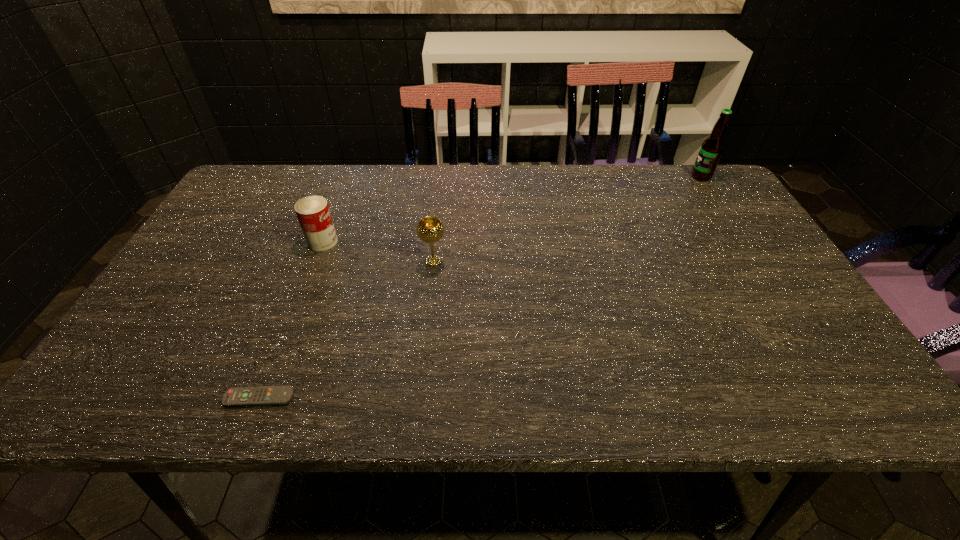
Locate an element on the screen. The height and width of the screenshot is (540, 960). vacant space that's between the remote control and the tallest object is located at coordinates (480, 287).

At what (x,y) coordinates should I click in order to perform the action: click on free spot between the shortest object and the beer bottle. Please return your answer as a coordinate pair (x, y). Looking at the image, I should click on (480, 287).

Identify which object is located as the nearest to the second nearest object. Please provide its 2D coordinates. Your answer should be formatted as a tuple, i.e. [(x, y)], where the tuple contains the x and y coordinates of a point satisfying the conditions above.

[(313, 213)]

This screenshot has width=960, height=540. Identify the location of object that is the second closest one to the third object from left to right. pyautogui.click(x=264, y=395).

At what (x,y) coordinates should I click in order to perform the action: click on vacant area in the image that satisfies the following two spatial constraints: 1. on the front label of the third object from left to right; 2. on the left side of the second farthest object. Please return your answer as a coordinate pair (x, y). The height and width of the screenshot is (540, 960). Looking at the image, I should click on (315, 261).

The height and width of the screenshot is (540, 960). I want to click on vacant area in the image that satisfies the following two spatial constraints: 1. on the front label of the third farthest object; 2. on the left side of the can, so click(x=315, y=261).

The height and width of the screenshot is (540, 960). Identify the location of blank area in the image that satisfies the following two spatial constraints: 1. on the back side of the chalice; 2. on the front label of the can. pos(436,241).

Image resolution: width=960 pixels, height=540 pixels. Find the location of `vacant point that satisfies the following two spatial constraints: 1. on the front label of the third object from left to right; 2. on the left side of the can`. vacant point that satisfies the following two spatial constraints: 1. on the front label of the third object from left to right; 2. on the left side of the can is located at coordinates (315, 261).

This screenshot has width=960, height=540. Find the location of `vacant space that satisfies the following two spatial constraints: 1. on the front label of the third object from left to right; 2. on the right side of the third nearest object`. vacant space that satisfies the following two spatial constraints: 1. on the front label of the third object from left to right; 2. on the right side of the third nearest object is located at coordinates (315, 261).

The width and height of the screenshot is (960, 540). What are the coordinates of `free space that satisfies the following two spatial constraints: 1. on the label of the farthest object; 2. on the front side of the third object from left to right` in the screenshot? It's located at (756, 261).